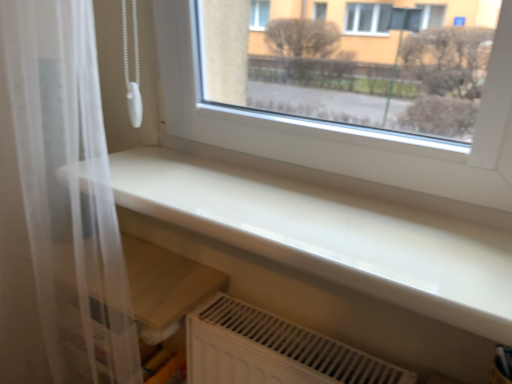
Question: Does white glossy counter top at lower center touch white sheer curtain at left?

Choices:
 (A) no
 (B) yes

Answer: (A)

Question: Is white glossy counter top at lower center shorter than white sheer curtain at left?

Choices:
 (A) no
 (B) yes

Answer: (B)

Question: Can you confirm if white glossy counter top at lower center is thinner than white sheer curtain at left?

Choices:
 (A) yes
 (B) no

Answer: (B)

Question: Is white glossy counter top at lower center further to the viewer compared to white sheer curtain at left?

Choices:
 (A) no
 (B) yes

Answer: (A)

Question: From the image's perspective, is white glossy counter top at lower center above white sheer curtain at left?

Choices:
 (A) no
 (B) yes

Answer: (B)

Question: Is white glossy counter top at lower center to the left of white sheer curtain at left from the viewer's perspective?

Choices:
 (A) no
 (B) yes

Answer: (A)

Question: Is white glossy counter top at lower center in contact with white plastic radiator at lower center?

Choices:
 (A) no
 (B) yes

Answer: (A)

Question: Is white glossy counter top at lower center looking in the opposite direction of white plastic radiator at lower center?

Choices:
 (A) yes
 (B) no

Answer: (B)

Question: Can you confirm if white glossy counter top at lower center is positioned to the right of white plastic radiator at lower center?

Choices:
 (A) yes
 (B) no

Answer: (B)

Question: Is white glossy counter top at lower center not inside white plastic radiator at lower center?

Choices:
 (A) yes
 (B) no

Answer: (A)

Question: From the image's perspective, is white glossy counter top at lower center above white plastic radiator at lower center?

Choices:
 (A) yes
 (B) no

Answer: (A)

Question: Considering the relative sizes of white glossy counter top at lower center and white plastic radiator at lower center in the image provided, is white glossy counter top at lower center smaller than white plastic radiator at lower center?

Choices:
 (A) yes
 (B) no

Answer: (B)

Question: Considering the relative sizes of white plastic radiator at lower center and white sheer curtain at left in the image provided, is white plastic radiator at lower center thinner than white sheer curtain at left?

Choices:
 (A) yes
 (B) no

Answer: (A)